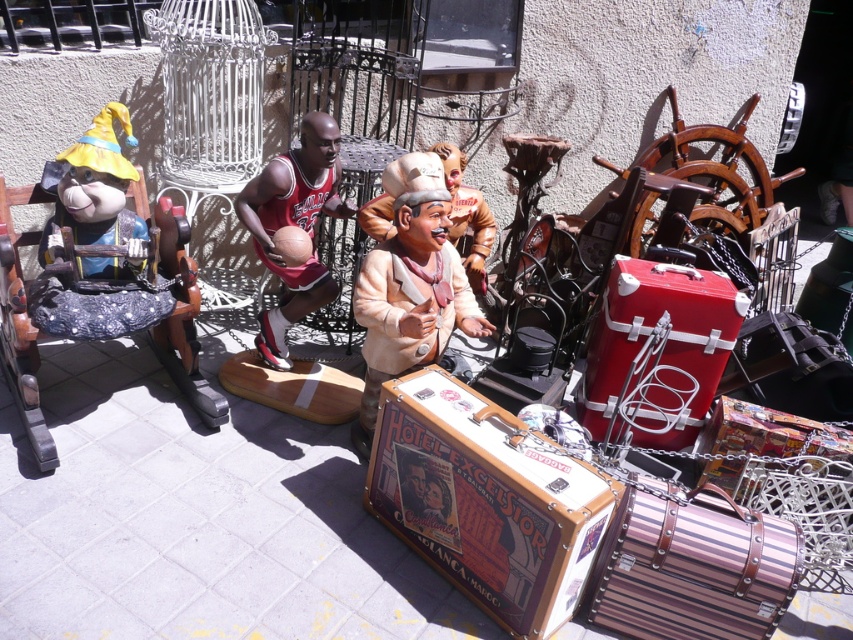
Question: Is wooden rocking horse at left closer to camera compared to red jersey basketball player at center?

Choices:
 (A) no
 (B) yes

Answer: (B)

Question: Which is nearer to the brown matte statue at center?

Choices:
 (A) wooden rocking horse at left
 (B) smooth leather suitcase at center
 (C) red jersey basketball player at center

Answer: (C)

Question: Which of the following is the closest to the observer?

Choices:
 (A) (183, 348)
 (B) (299, 307)
 (C) (396, 220)

Answer: (C)

Question: Does red jersey basketball player at center appear under smooth leather suitcase at center?

Choices:
 (A) no
 (B) yes

Answer: (A)

Question: Based on their relative distances, which object is nearer to the smooth leather suitcase at center?

Choices:
 (A) wooden rocking horse at left
 (B) red jersey basketball player at center

Answer: (B)

Question: Is brown matte statue at center bigger than red jersey basketball player at center?

Choices:
 (A) no
 (B) yes

Answer: (B)